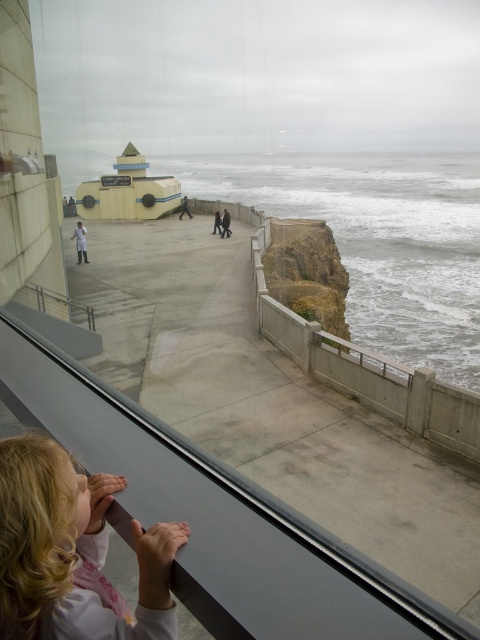
You are a tourist standing inside the building and looking through the glass where the child is observing. You want to take a photo of the brown rocky cliff at center and the white matte shirt at center in the same frame. Which object should you zoom in on to ensure both are visible without cropping?

You should zoom in on the white matte shirt at center because the brown rocky cliff at center is wider than the white matte shirt at center, so focusing on the narrower object allows both to fit in the frame.

In the scene shown: You are a tailor observing a child wearing a white matte shirt at center and a dark gray jacket at center. Which piece of clothing takes up more space on the child?

The dark gray jacket at center takes up more space than the white matte shirt at center because the white matte shirt at center occupies less space than the dark gray jacket at center.

You are a visitor standing inside the building and looking through the glass. You notice the brown rocky cliff at center and the white matte shirt at center. Which object is taller?

The brown rocky cliff at center is taller than the white matte shirt at center.